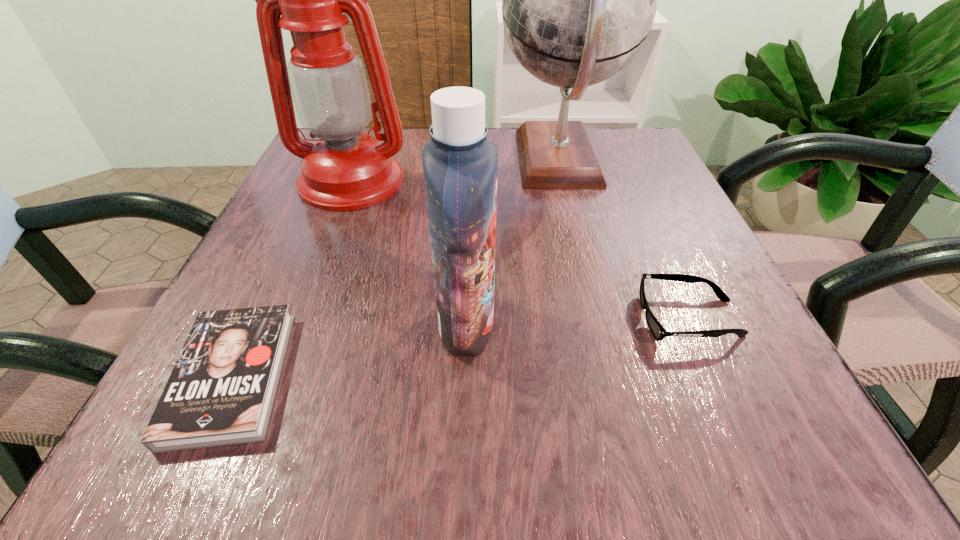
This screenshot has width=960, height=540. Identify the location of free space between the fourth tallest object and the third tallest object. (577, 321).

Locate an element on the screen. This screenshot has width=960, height=540. object that ranks as the closest to the shortest object is located at coordinates tap(460, 164).

Identify which object is the fourth nearest to the third tallest object. Please provide its 2D coordinates. Your answer should be formatted as a tuple, i.e. [(x, y)], where the tuple contains the x and y coordinates of a point satisfying the conditions above.

[(579, 0)]

Locate an element on the screen. blank space that satisfies the following two spatial constraints: 1. at the equator of the globe; 2. on the front side of the oil lamp is located at coordinates (564, 181).

Find the location of `vacant region that satisfies the following two spatial constraints: 1. at the equator of the globe; 2. on the front side of the book`. vacant region that satisfies the following two spatial constraints: 1. at the equator of the globe; 2. on the front side of the book is located at coordinates (612, 376).